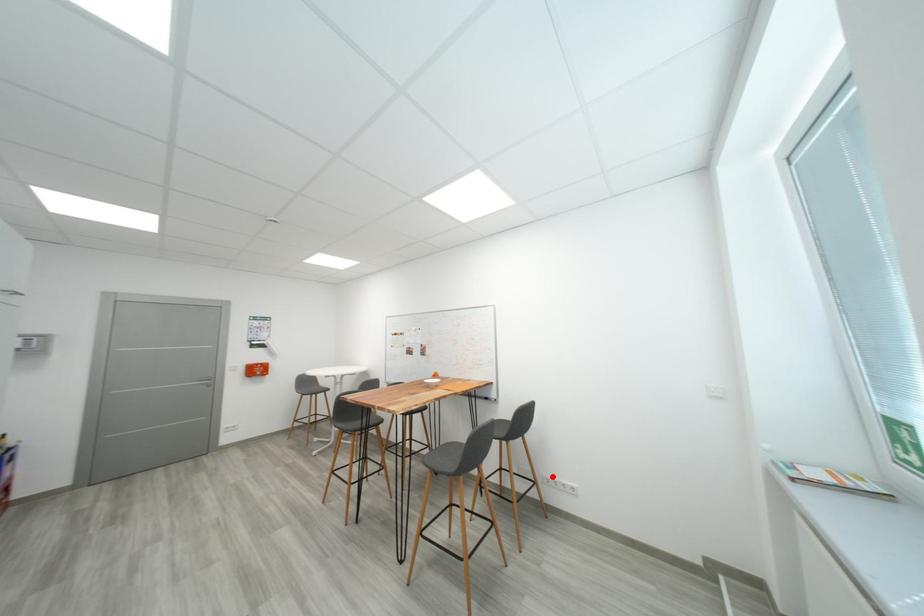
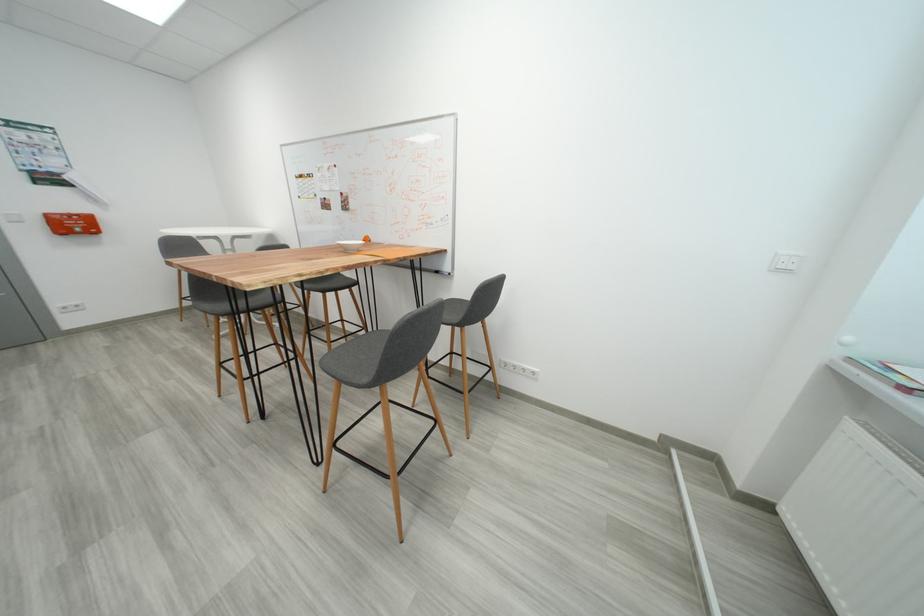
Question: I am providing you with two images of the same scene from different viewpoints. A red point is shown in image1. For the corresponding object point in image2, is it positioned nearer or farther from the camera?

Choices:
 (A) Nearer
 (B) Farther

Answer: (A)